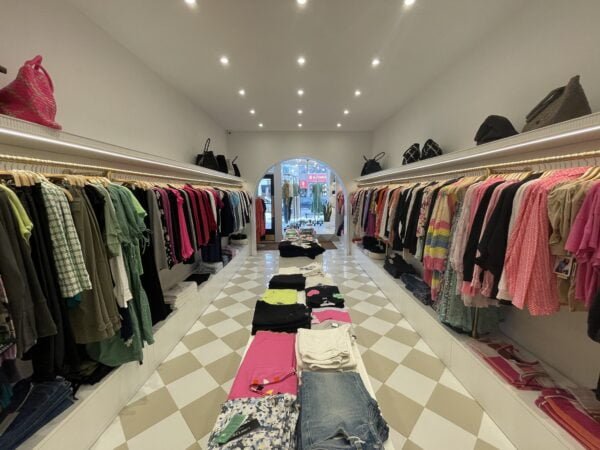
The height and width of the screenshot is (450, 600). Identify the location of overhead lighting. (370, 72), (303, 57), (225, 56).